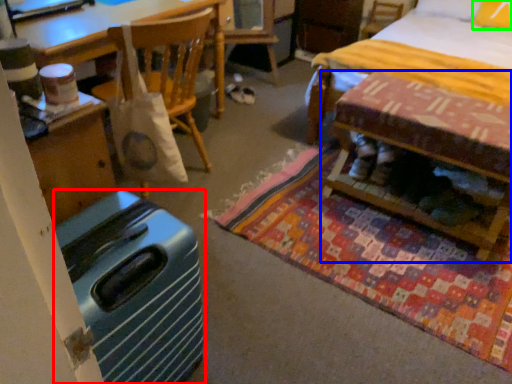
Question: Which object is positioned closest to luggage (highlighted by a red box)? Select from table (highlighted by a blue box) and pillow (highlighted by a green box).

Choices:
 (A) table
 (B) pillow

Answer: (A)